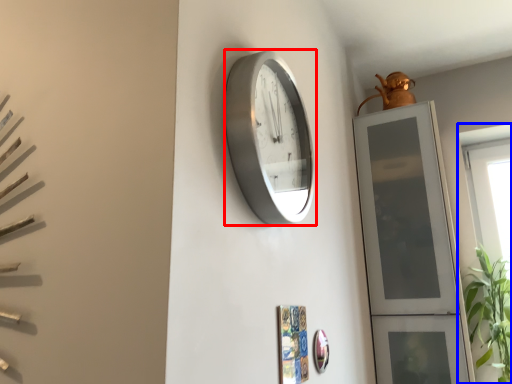
Question: Which of the following is the closest to the observer, wall clock (highlighted by a red box) or window (highlighted by a blue box)?

Choices:
 (A) wall clock
 (B) window

Answer: (A)